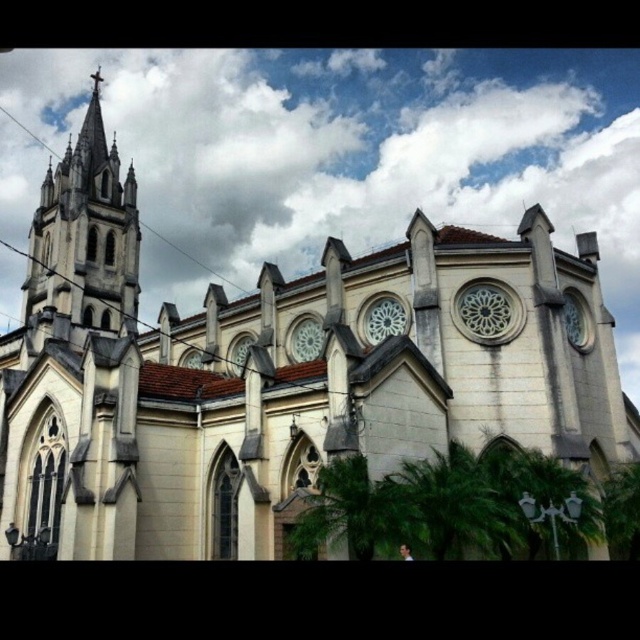
Is point (445, 454) closer to viewer compared to point (292, 540)?

No, (445, 454) is behind (292, 540).

The height and width of the screenshot is (640, 640). Find the location of `green leafy palm at lower center`. green leafy palm at lower center is located at coordinates (449, 506).

You are a GUI agent. You are given a task and a screenshot of the screen. Output one action in this format:
    pyautogui.click(x=<x>, y=<y>)
    Task: Click on the green leafy palm at lower center
    
    Given the screenshot: What is the action you would take?
    pyautogui.click(x=449, y=506)

Between white stone tower at upper left and green leafy palm at lower center, which one appears on the right side from the viewer's perspective?

green leafy palm at lower center is more to the right.

Looking at this image, measure the distance from white stone tower at upper left to green leafy palm at lower center.

329.21 feet

This screenshot has height=640, width=640. What do you see at coordinates (84, 234) in the screenshot?
I see `white stone tower at upper left` at bounding box center [84, 234].

Image resolution: width=640 pixels, height=640 pixels. Find the location of `white stone tower at upper left`. white stone tower at upper left is located at coordinates (84, 234).

Between point (97, 307) and point (528, 548), which one is positioned in front?

Point (528, 548) is in front.

Can you confirm if white stone tower at upper left is positioned to the left of green leafy palm at lower right?

Correct, you'll find white stone tower at upper left to the left of green leafy palm at lower right.

Find the location of `white stone tower at upper left`. white stone tower at upper left is located at coordinates (84, 234).